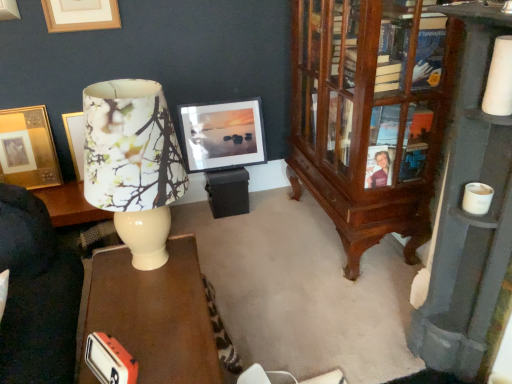
Image resolution: width=512 pixels, height=384 pixels. I want to click on vacant area that lies in front of floral paper lampshade at left, so click(148, 321).